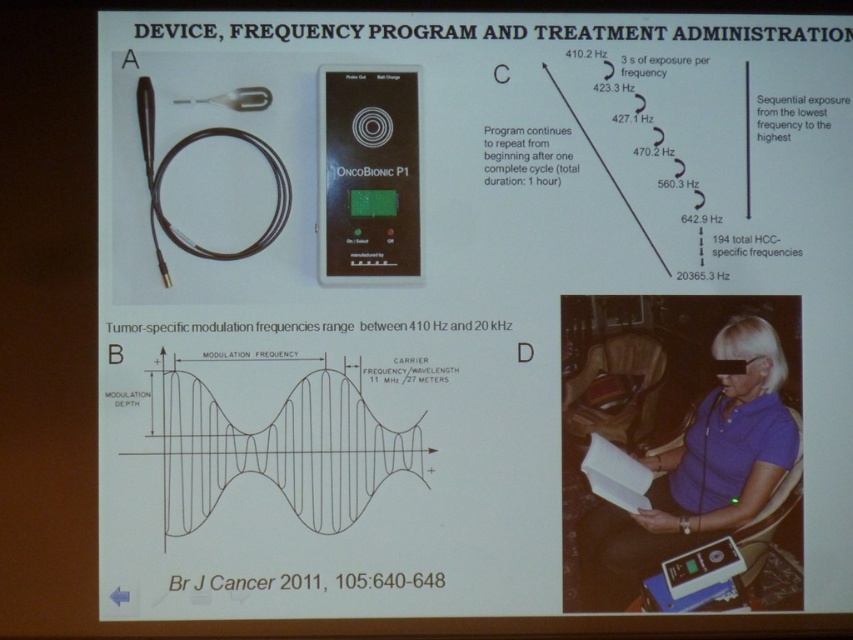
Question: Which point is closer to the camera?

Choices:
 (A) black plastic oncobionic p1 at center
 (B) purple fabric shirt at center

Answer: (A)

Question: From the image, what is the correct spatial relationship of purple fabric shirt at center in relation to black plastic oncobionic p1 at center?

Choices:
 (A) left
 (B) right

Answer: (B)

Question: Which of the following is the closest to the observer?

Choices:
 (A) (778, 448)
 (B) (374, 237)

Answer: (A)

Question: Which of the following is the farthest from the observer?

Choices:
 (A) (415, 150)
 (B) (692, 532)

Answer: (A)

Question: Can you confirm if purple fabric shirt at center is positioned to the right of black plastic oncobionic p1 at center?

Choices:
 (A) yes
 (B) no

Answer: (A)

Question: Is purple fabric shirt at center wider than black plastic oncobionic p1 at center?

Choices:
 (A) no
 (B) yes

Answer: (B)